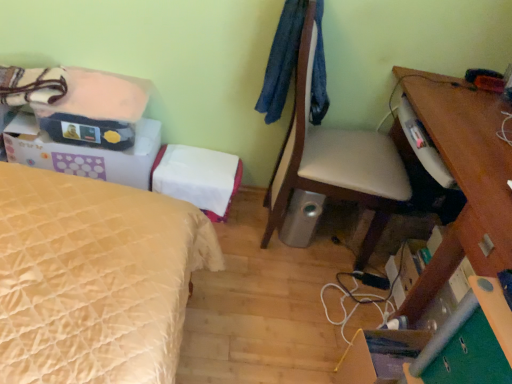
Question: Should I look upward or downward to see silver metallic speaker at lower center?

Choices:
 (A) down
 (B) up

Answer: (A)

Question: Does silver metallic speaker at lower center appear on the left side of white leather chair at center?

Choices:
 (A) yes
 (B) no

Answer: (A)

Question: Does silver metallic speaker at lower center have a lesser height compared to white leather chair at center?

Choices:
 (A) yes
 (B) no

Answer: (A)

Question: Is silver metallic speaker at lower center facing away from white leather chair at center?

Choices:
 (A) no
 (B) yes

Answer: (B)

Question: Would you say silver metallic speaker at lower center is outside white leather chair at center?

Choices:
 (A) yes
 (B) no

Answer: (B)

Question: Considering the relative positions of silver metallic speaker at lower center and white leather chair at center in the image provided, is silver metallic speaker at lower center behind white leather chair at center?

Choices:
 (A) yes
 (B) no

Answer: (A)

Question: From the image's perspective, would you say silver metallic speaker at lower center is shown under white leather chair at center?

Choices:
 (A) no
 (B) yes

Answer: (B)

Question: From a real-world perspective, is green felt drawer at lower right below matte black bag at upper left?

Choices:
 (A) yes
 (B) no

Answer: (B)

Question: From a real-world perspective, is green felt drawer at lower right located higher than matte black bag at upper left?

Choices:
 (A) no
 (B) yes

Answer: (B)

Question: Is green felt drawer at lower right positioned in front of matte black bag at upper left?

Choices:
 (A) yes
 (B) no

Answer: (A)

Question: Considering the relative positions of green felt drawer at lower right and matte black bag at upper left in the image provided, is green felt drawer at lower right to the right of matte black bag at upper left from the viewer's perspective?

Choices:
 (A) yes
 (B) no

Answer: (A)

Question: Does green felt drawer at lower right have a smaller size compared to matte black bag at upper left?

Choices:
 (A) yes
 (B) no

Answer: (A)

Question: Is green felt drawer at lower right aimed at matte black bag at upper left?

Choices:
 (A) yes
 (B) no

Answer: (B)

Question: From a real-world perspective, does matte cardboard box at lower right, arranged as the 3th storage box when viewed from the top, stand above matte black bag at upper left?

Choices:
 (A) no
 (B) yes

Answer: (A)